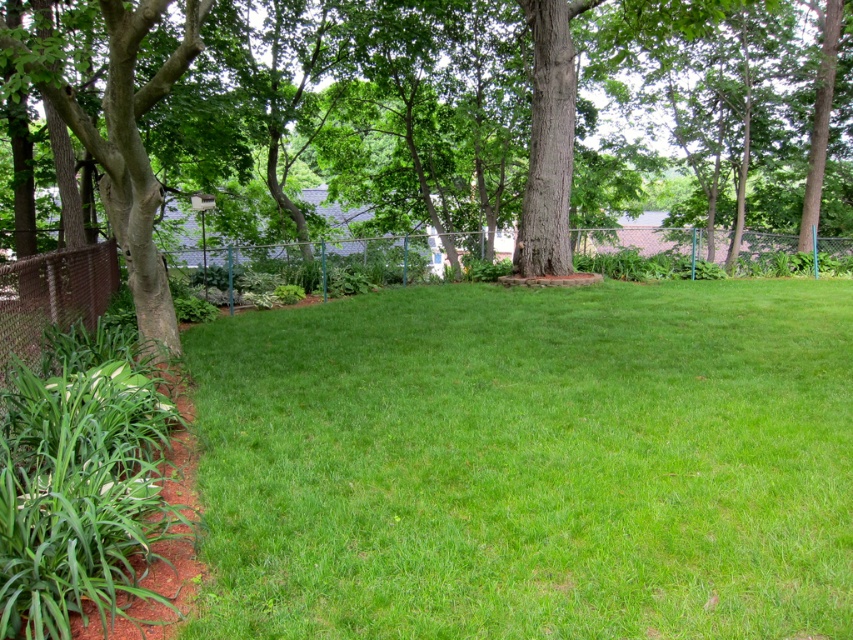
Question: Which object is closer to the camera taking this photo?

Choices:
 (A) green leafy tree at center
 (B) brown chain-link fence at lower left
 (C) green grass at center

Answer: (C)

Question: Which of the following is the closest to the observer?

Choices:
 (A) green leafy tree at center
 (B) brown chain-link fence at lower left
 (C) green grass at center

Answer: (C)

Question: Observing the image, what is the correct spatial positioning of green leafy tree at center in reference to brown chain-link fence at lower left?

Choices:
 (A) below
 (B) above

Answer: (B)

Question: Does green grass at center lie in front of brown chain-link fence at lower left?

Choices:
 (A) yes
 (B) no

Answer: (A)

Question: Is green leafy tree at center further to the viewer compared to brown chain-link fence at lower left?

Choices:
 (A) no
 (B) yes

Answer: (B)

Question: Which point is farther to the camera?

Choices:
 (A) green leafy tree at center
 (B) green grass at center
 (C) brown chain-link fence at lower left

Answer: (A)